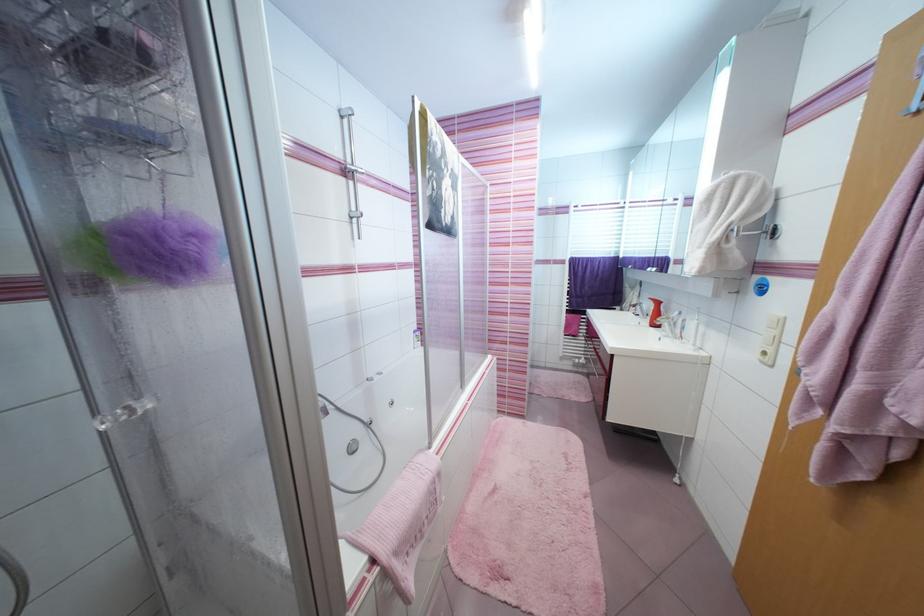
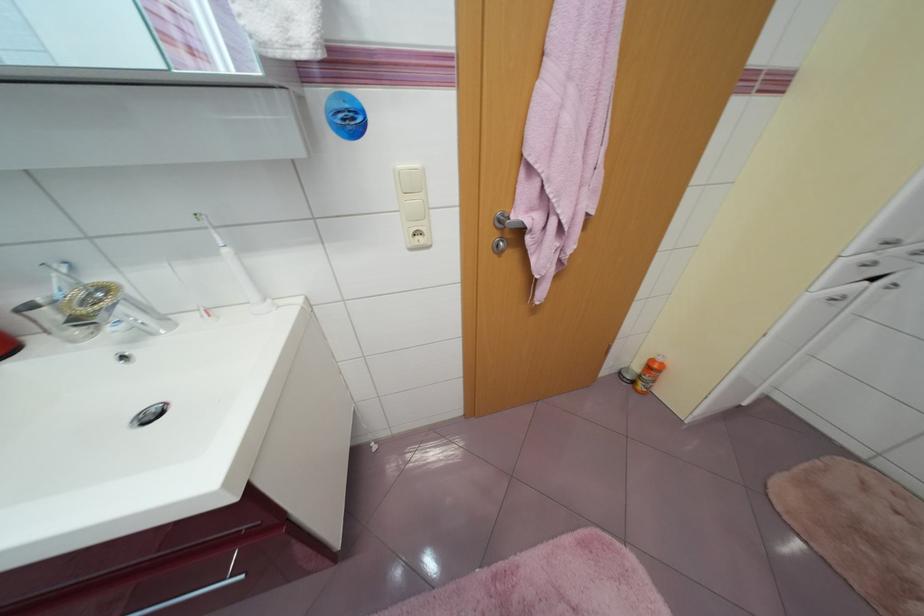
The point at (699, 346) is marked in the first image. Where is the corresponding point in the second image?

(270, 302)